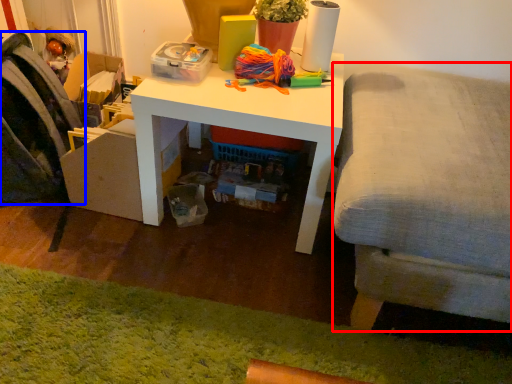
Question: Which point is further to the camera, studio couch (highlighted by a red box) or swivel chair (highlighted by a blue box)?

Choices:
 (A) studio couch
 (B) swivel chair

Answer: (B)